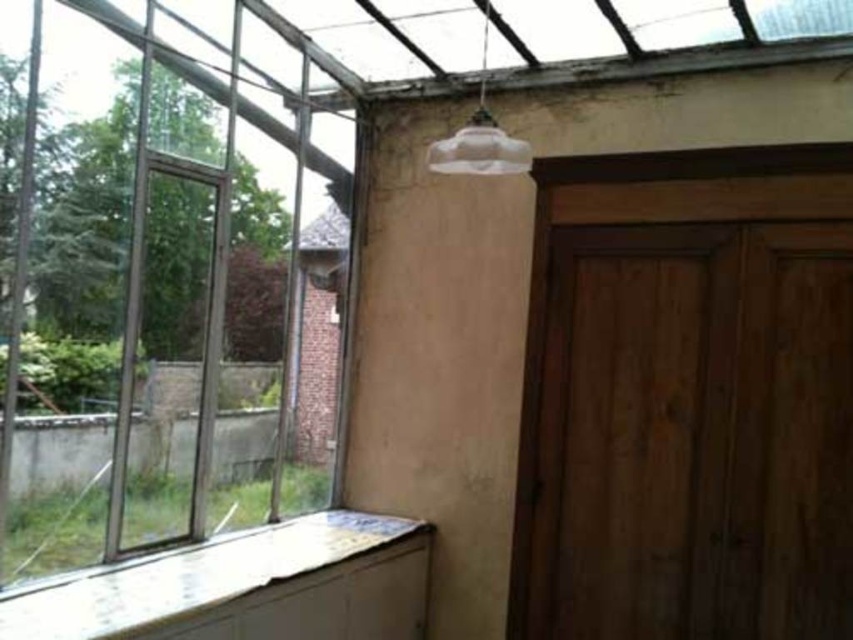
You are an interior designer assessing the conservatory. You need to determine if the clear glass window at left can accommodate a large decorative panel that requires a space larger than the translucent glass lampshade at upper center. Can it fit?

The clear glass window at left is bigger than the translucent glass lampshade at upper center, so the decorative panel requiring a space larger than the lampshade can fit in the clear glass window at left.

You are standing in the conservatory and want to exit through the door. The door is located at the point with coordinates (160, 301). However, the door is behind a glass window. Can you see the door through the clear glass window at left?

The point (160, 301) is on clear glass window at left, so yes, the door can be seen through the clear glass window at left because the glass is clear.

You are standing in the conservatory and need to locate the clear glass window at left and the white painted wood at lower left. From your vantage point, which object is positioned to the left of the other?

The clear glass window at left is to the left of white painted wood at lower left.